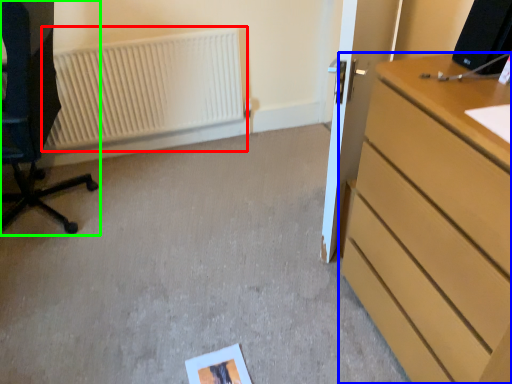
Question: Which is nearer to the radiator (highlighted by a red box)? chest of drawers (highlighted by a blue box) or furniture (highlighted by a green box).

Choices:
 (A) chest of drawers
 (B) furniture

Answer: (B)